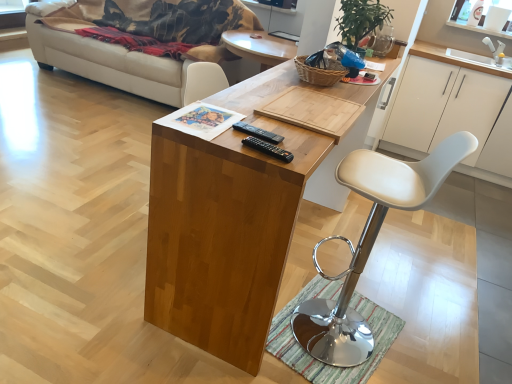
Identify the location of free space between black plastic remote at center, the 1th remote in the front-to-back sequence, and black plastic remote at center, placed as the first remote when sorted from back to front. (253, 141).